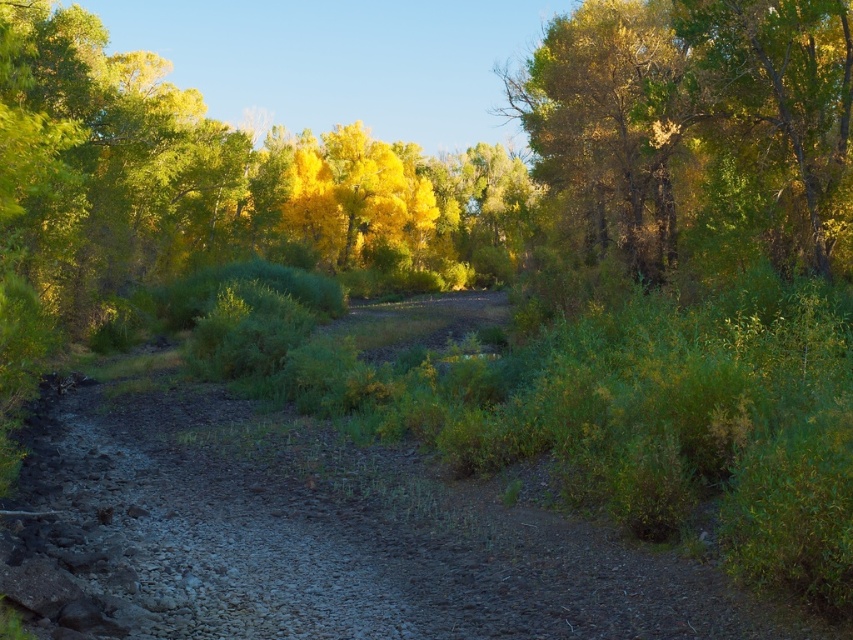
You are a hiker who wants to know if the dull brown dirt track at center is longer than the green leafy tree at upper right. Based on the scene, can you confirm?

The dull brown dirt track at center is shorter than the green leafy tree at upper right, so no, the track is not longer than the tree.

You are a hiker who wants to take a photo of the dull brown dirt track at center. Where exactly should you position your camera to capture it?

The dull brown dirt track at center is located at point (334, 532), so you should position your camera to aim at that coordinate to capture it.

You are a hiker who wants to take a photo of the green leafy tree at upper right. You are currently standing on the dull brown dirt track at center. Which direction should you walk to get a better view of the tree?

The dull brown dirt track at center is to the left of the green leafy tree at upper right, so you should walk to the right to get a better view of the tree.